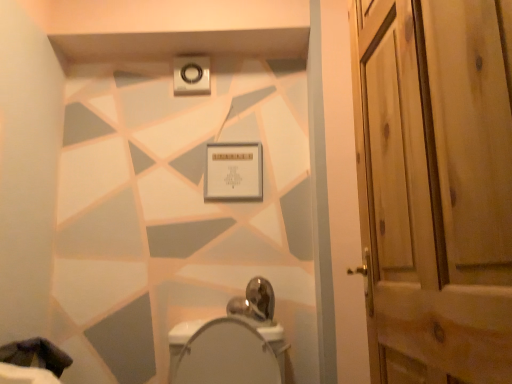
Question: In terms of height, does wooden door at right look taller or shorter compared to dark fabric at lower left?

Choices:
 (A) tall
 (B) short

Answer: (A)

Question: Choose the correct answer: Is wooden door at right inside dark fabric at lower left or outside it?

Choices:
 (A) outside
 (B) inside

Answer: (A)

Question: Considering the real-world distances, which object is farthest from the wooden door at right?

Choices:
 (A) white glossy bidet at center
 (B) dark fabric at lower left

Answer: (B)

Question: Estimate the real-world distances between objects in this image. Which object is farther from the dark fabric at lower left?

Choices:
 (A) white glossy bidet at center
 (B) wooden door at right

Answer: (B)